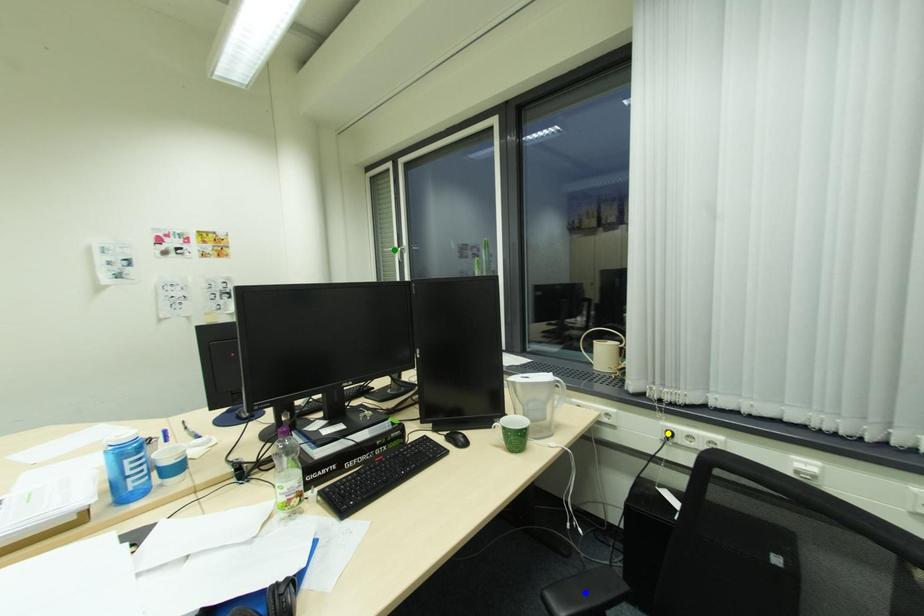
Order these from nearest to farthest:
1. blue point
2. green point
3. yellow point

1. blue point
2. yellow point
3. green point